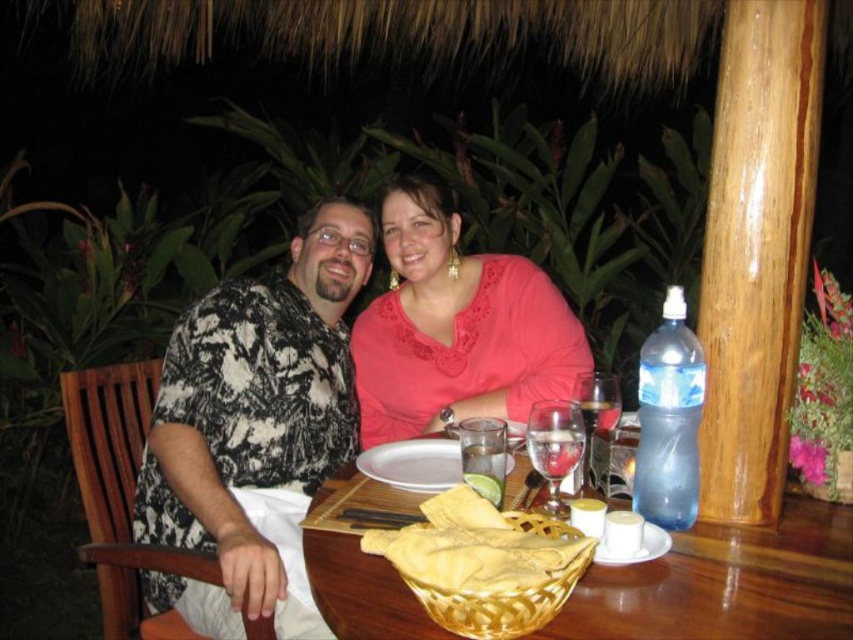
Is wooden table at center positioned in front of pink lace blouse at center?

Yes, wooden table at center is in front of pink lace blouse at center.

Is wooden table at center smaller than pink lace blouse at center?

Yes, wooden table at center is smaller than pink lace blouse at center.

The height and width of the screenshot is (640, 853). I want to click on wooden table at center, so click(x=726, y=584).

Which is more to the left, wooden table at center or transparent glass wine glass at upper center?

From the viewer's perspective, wooden table at center appears more on the left side.

Is wooden table at center to the left of transparent glass wine glass at upper center from the viewer's perspective?

Yes, wooden table at center is to the left of transparent glass wine glass at upper center.

Image resolution: width=853 pixels, height=640 pixels. In order to click on wooden table at center in this screenshot , I will do `click(726, 584)`.

Is yellow wicker basket at table center shorter than white ceramic plate at center?

Yes, yellow wicker basket at table center is shorter than white ceramic plate at center.

Is point (476, 525) positioned after point (437, 438)?

No, (476, 525) is in front of (437, 438).

What do you see at coordinates (476, 547) in the screenshot? This screenshot has height=640, width=853. I see `yellow wicker basket at table center` at bounding box center [476, 547].

The width and height of the screenshot is (853, 640). What are the coordinates of `yellow wicker basket at table center` in the screenshot? It's located at (476, 547).